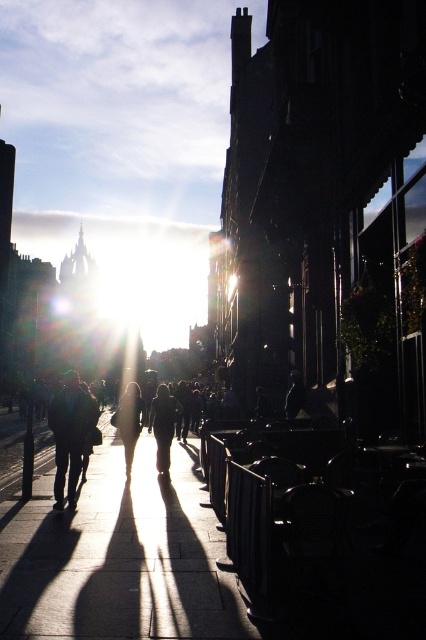
You are standing in the vibrant street scene and want to take a photo of both the point at coordinates point (20, 582) and point (304, 396). Which point should you focus on first to ensure both are in sharp focus?

You should focus on point (20, 582) first because it is closer to the camera, ensuring that both points will be in focus when using a proper depth of field.

Based on the photo, you are standing on the smooth concrete sidewalk at center and looking up at the matte black person at center. Which object is closer to the ground?

The smooth concrete sidewalk at center is closer to the ground because it is located below the matte black person at center.

You are standing at the edge of the street and want to walk to the matte black person at center without stepping on the smooth concrete sidewalk at center. Is this possible?

The smooth concrete sidewalk at center is closer to the viewer than the matte black person at center, so you would have to step on the sidewalk to reach the person.